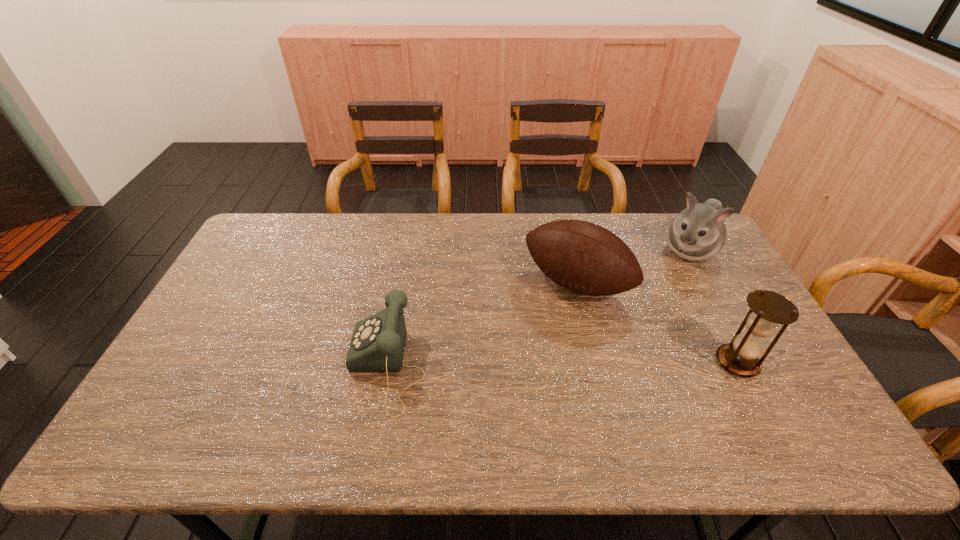
The width and height of the screenshot is (960, 540). What are the coordinates of `free space located on the face of the hamster` in the screenshot? It's located at (658, 299).

I want to click on free space located 0.240m on the face of the hamster, so click(x=651, y=308).

I want to click on vacant space positioned 0.240m on the laces of the third object from right to left, so click(x=515, y=363).

In order to click on vacant space located on the laces of the third object from right to left in this screenshot , I will do `click(520, 355)`.

Locate an element on the screen. free region located on the laces of the third object from right to left is located at coordinates (544, 320).

Locate an element on the screen. object that is at the far edge is located at coordinates (698, 233).

I want to click on object that is at the near edge, so click(x=378, y=342).

Locate an element on the screen. This screenshot has width=960, height=540. hourglass that is at the right edge is located at coordinates (768, 309).

The width and height of the screenshot is (960, 540). I want to click on hamster positioned at the right edge, so click(698, 233).

This screenshot has height=540, width=960. I want to click on object that is at the far right corner, so click(x=698, y=233).